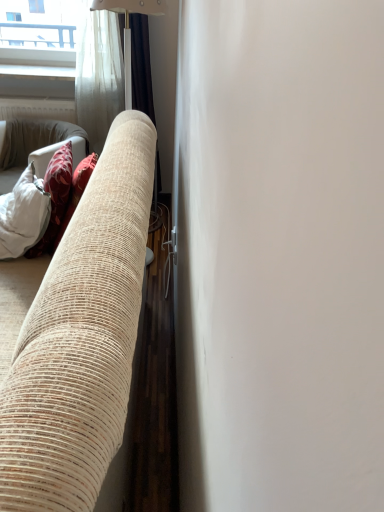
Question: Should I look upward or downward to see silky beige curtain at center?

Choices:
 (A) down
 (B) up

Answer: (B)

Question: Is silky beige curtain at center further to the viewer compared to beige textured fabric couch at left?

Choices:
 (A) no
 (B) yes

Answer: (B)

Question: Is silky beige curtain at center turned away from beige textured fabric couch at left?

Choices:
 (A) yes
 (B) no

Answer: (B)

Question: Does silky beige curtain at center appear on the right side of beige textured fabric couch at left?

Choices:
 (A) yes
 (B) no

Answer: (A)

Question: From a real-world perspective, is silky beige curtain at center positioned over beige textured fabric couch at left based on gravity?

Choices:
 (A) yes
 (B) no

Answer: (A)

Question: Is silky beige curtain at center in front of beige textured fabric couch at left?

Choices:
 (A) no
 (B) yes

Answer: (A)

Question: Is silky beige curtain at center not near beige textured fabric couch at left?

Choices:
 (A) no
 (B) yes

Answer: (B)

Question: Can you confirm if beige textured fabric couch at left is smaller than silky beige curtain at center?

Choices:
 (A) yes
 (B) no

Answer: (B)

Question: Can you confirm if beige textured fabric couch at left is shorter than silky beige curtain at center?

Choices:
 (A) yes
 (B) no

Answer: (A)

Question: Does beige textured fabric couch at left come in front of silky beige curtain at center?

Choices:
 (A) no
 (B) yes

Answer: (B)

Question: Is beige textured fabric couch at left further to the viewer compared to silky beige curtain at center?

Choices:
 (A) no
 (B) yes

Answer: (A)

Question: Is beige textured fabric couch at left outside silky beige curtain at center?

Choices:
 (A) no
 (B) yes

Answer: (B)

Question: From a real-world perspective, does beige textured fabric couch at left sit lower than silky beige curtain at center?

Choices:
 (A) no
 (B) yes

Answer: (B)

Question: From a real-world perspective, is beige textured fabric couch at left above or below silky beige curtain at center?

Choices:
 (A) above
 (B) below

Answer: (B)